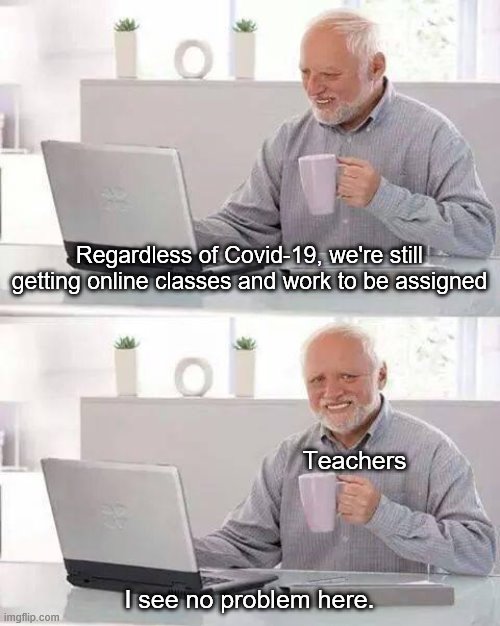
Identify the location of windows. This screenshot has height=626, width=500. (427, 42), (431, 356), (496, 346), (393, 344), (394, 19).